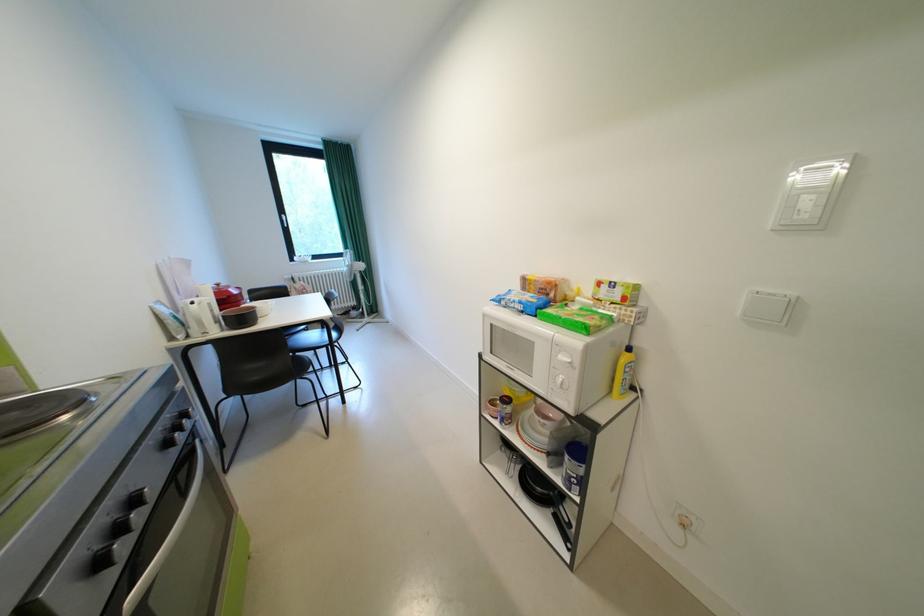
This screenshot has height=616, width=924. What do you see at coordinates (284, 221) in the screenshot?
I see `the window handle` at bounding box center [284, 221].